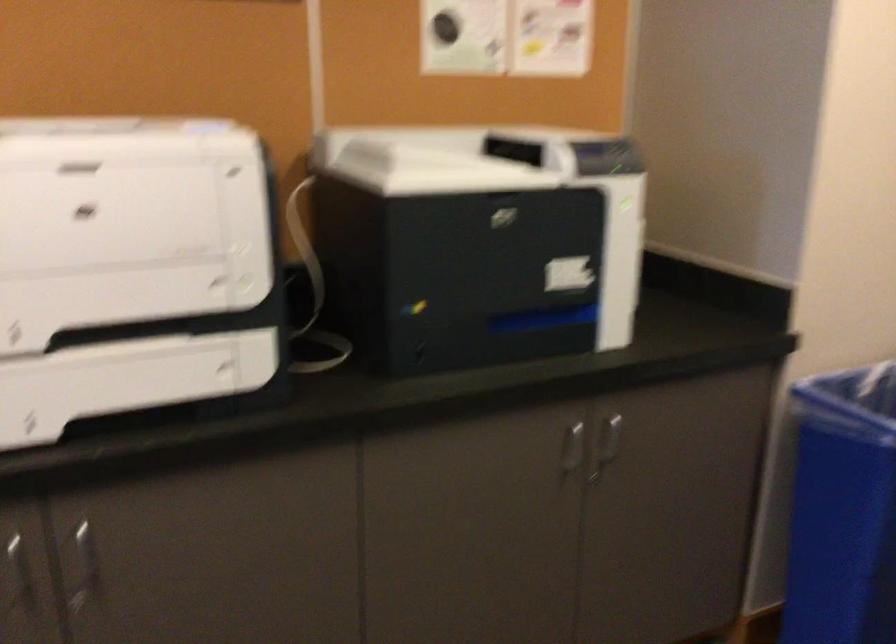
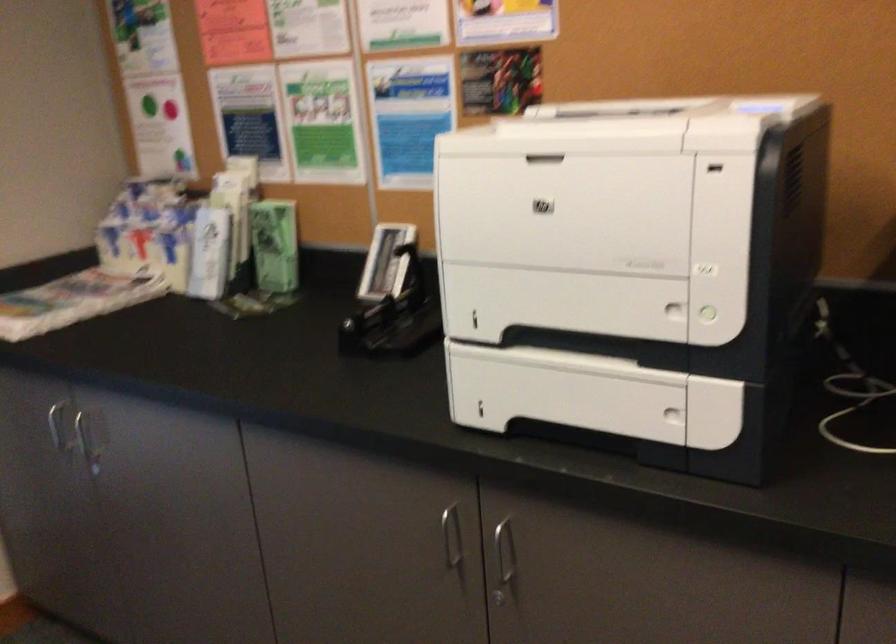
Question: The first image is from the beginning of the video and the second image is from the end. How did the camera likely rotate when shooting the video?

Choices:
 (A) Left
 (B) Right
 (C) Up
 (D) Down

Answer: (A)